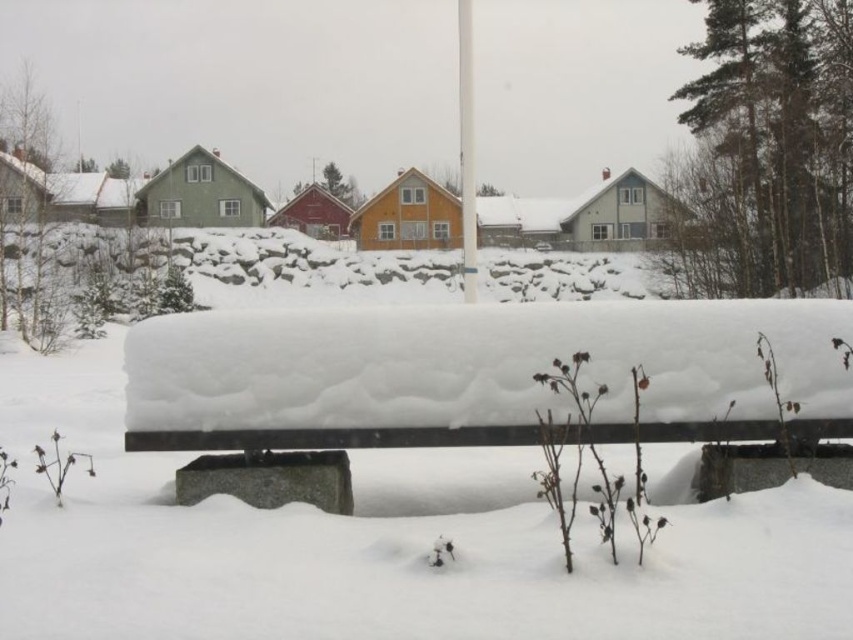
Which is more to the left, concrete bench at center or white plastic pole at center?

concrete bench at center is more to the left.

Who is more forward, (659, 429) or (471, 192)?

Point (659, 429)

Find the location of a particular element. concrete bench at center is located at coordinates (329, 438).